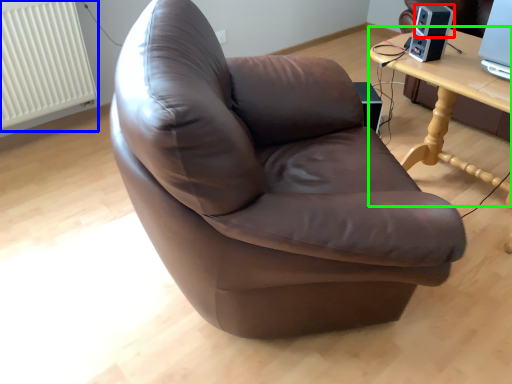
Question: Based on their relative distances, which object is nearer to speaker (highlighted by a red box)? Choose from radiator (highlighted by a blue box) and table (highlighted by a green box).

Choices:
 (A) radiator
 (B) table

Answer: (B)